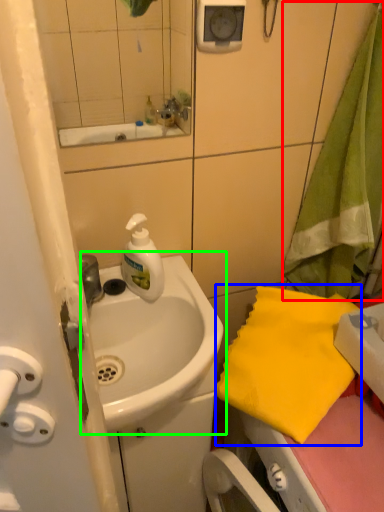
Question: Considering the real-world distances, which object is farthest from beach towel (highlighted by a red box)? beach towel (highlighted by a blue box) or sink (highlighted by a green box)?

Choices:
 (A) beach towel
 (B) sink

Answer: (B)